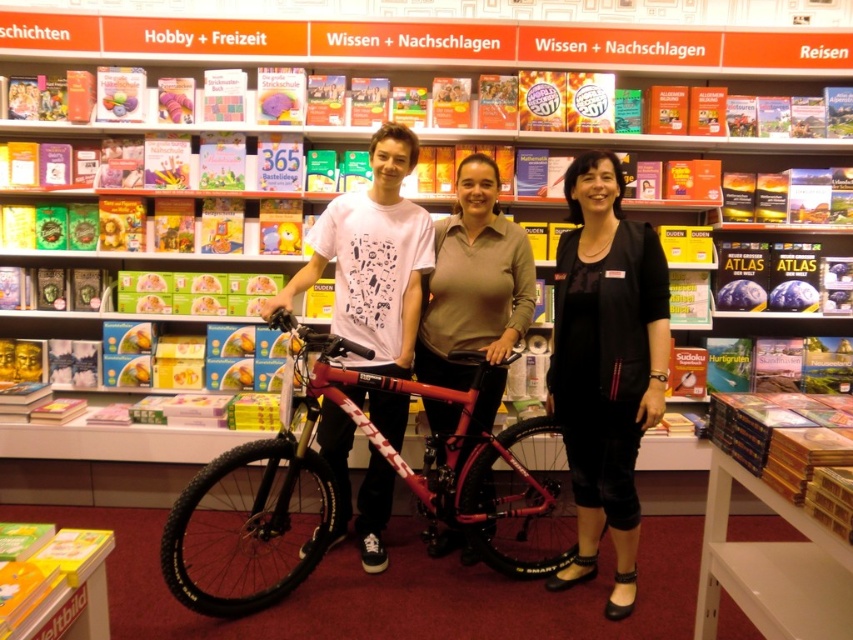
Question: Is black matte pants at lower right below matte white t-shirt at center?

Choices:
 (A) no
 (B) yes

Answer: (B)

Question: Which of these objects is positioned farthest from the matte black bicycle at center?

Choices:
 (A) matte pink bicycle at center
 (B) shiny metallic bicycle at center

Answer: (B)

Question: Can you confirm if shiny metallic bicycle at center is wider than black matte pants at lower right?

Choices:
 (A) no
 (B) yes

Answer: (B)

Question: Estimate the real-world distances between objects in this image. Which object is farther from the matte black bicycle at center?

Choices:
 (A) black matte pants at lower right
 (B) matte pink bicycle at center

Answer: (B)

Question: Which point is closer to the camera taking this photo?

Choices:
 (A) (393, 433)
 (B) (241, 588)
 (C) (630, 486)

Answer: (C)

Question: Does shiny metallic bicycle at center have a greater width compared to matte black bicycle at center?

Choices:
 (A) yes
 (B) no

Answer: (A)